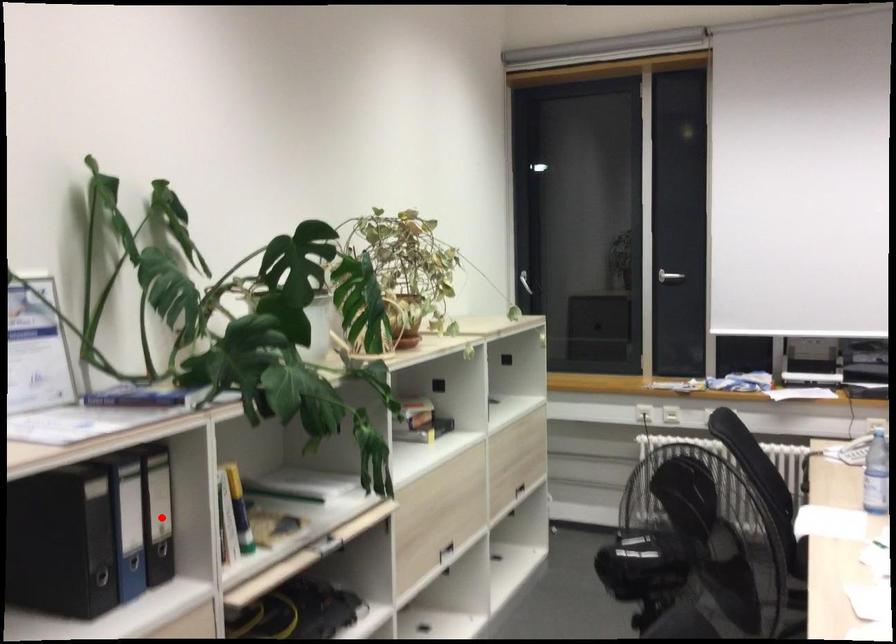
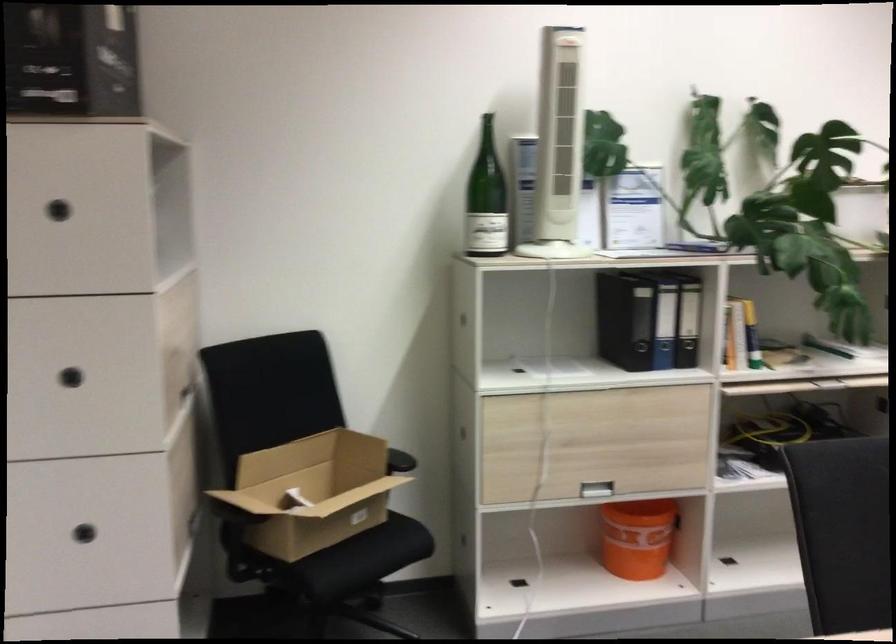
The point at the highlighted location is marked in the first image. Where is the corresponding point in the second image?

(688, 321)